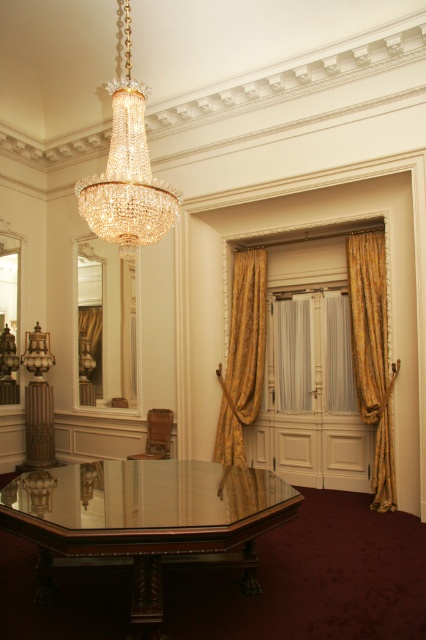
Question: Is gold textured curtain at center thinner than wooden chair at center?

Choices:
 (A) no
 (B) yes

Answer: (A)

Question: Which of these objects is positioned closest to the wooden chair at center?

Choices:
 (A) polished glass table at center
 (B) gold textured curtain at right

Answer: (B)

Question: Does gold textured curtain at right have a larger size compared to gold textured curtain at center?

Choices:
 (A) yes
 (B) no

Answer: (B)

Question: Among these points, which one is farthest from the camera?

Choices:
 (A) (199, 502)
 (B) (129, 61)
 (C) (370, 257)

Answer: (B)

Question: Is gold textured curtain at right wider than wooden chair at center?

Choices:
 (A) yes
 (B) no

Answer: (B)

Question: Which point appears farthest from the camera in this image?

Choices:
 (A) (382, 360)
 (B) (126, 180)

Answer: (A)